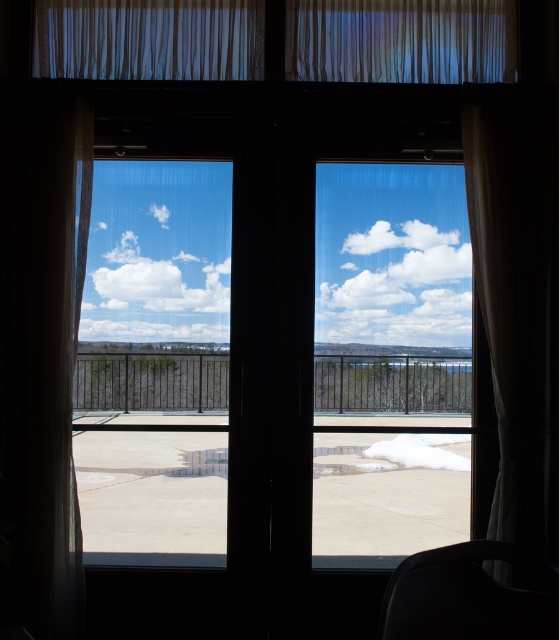
You are standing inside the room near the dark wooden double doors. You see two points marked on the window glass, one at point coordinates point (7, 241) and the other at point coordinates point (191, 548). Which point is closer to you, the observer, when looking through the window?

Point (7, 241) is in front of point (191, 548), so the point at coordinates point (7, 241) is closer to you.

You are standing inside a room with a large window framed by dark wooden double doors. You notice a white sheer curtain at right. Can you determine if the curtain is closer to the window or the door?

The white sheer curtain at right is located at point (518, 296), which places it closer to the window than the door.